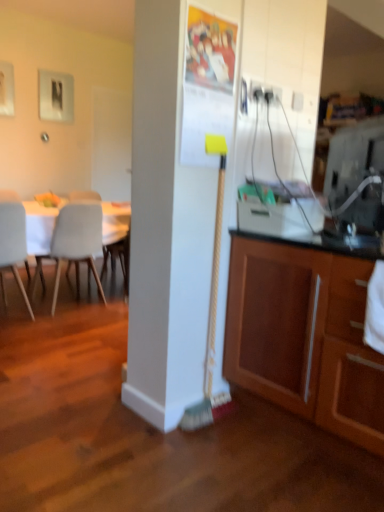
Question: Is white matte chair at left, which is counted as the 2th chair, starting from the right, beside light gray plastic chair at left, acting as the 2th chair starting from the left?

Choices:
 (A) no
 (B) yes

Answer: (A)

Question: Considering the relative sizes of white matte chair at left, which is counted as the 2th chair, starting from the right, and light gray plastic chair at left, acting as the 2th chair starting from the left, in the image provided, is white matte chair at left, which is counted as the 2th chair, starting from the right, taller than light gray plastic chair at left, acting as the 2th chair starting from the left,?

Choices:
 (A) yes
 (B) no

Answer: (A)

Question: From the image's perspective, does white matte chair at left, which is counted as the 2th chair, starting from the right, appear higher than light gray plastic chair at left, the first chair from the right?

Choices:
 (A) yes
 (B) no

Answer: (B)

Question: Is white matte chair at left, which is counted as the first chair, starting from the left, in front of light gray plastic chair at left, acting as the 2th chair starting from the left?

Choices:
 (A) no
 (B) yes

Answer: (B)

Question: Would you say white matte chair at left, which is counted as the first chair, starting from the left, is a long distance from light gray plastic chair at left, acting as the 2th chair starting from the left?

Choices:
 (A) yes
 (B) no

Answer: (B)

Question: Does white matte chair at left, which is counted as the first chair, starting from the left, have a lesser width compared to light gray plastic chair at left, the first chair from the right?

Choices:
 (A) yes
 (B) no

Answer: (B)

Question: Does light gray plastic chair at left, acting as the 2th chair starting from the left, have a lesser width compared to yellow-bristled broom at center?

Choices:
 (A) yes
 (B) no

Answer: (B)

Question: From a real-world perspective, is light gray plastic chair at left, the first chair from the right, physically below yellow-bristled broom at center?

Choices:
 (A) no
 (B) yes

Answer: (B)

Question: Can you confirm if light gray plastic chair at left, the first chair from the right, is shorter than yellow-bristled broom at center?

Choices:
 (A) no
 (B) yes

Answer: (B)

Question: Considering the relative sizes of light gray plastic chair at left, acting as the 2th chair starting from the left, and yellow-bristled broom at center in the image provided, is light gray plastic chair at left, acting as the 2th chair starting from the left, taller than yellow-bristled broom at center?

Choices:
 (A) yes
 (B) no

Answer: (B)

Question: Can you confirm if light gray plastic chair at left, acting as the 2th chair starting from the left, is positioned to the left of yellow-bristled broom at center?

Choices:
 (A) yes
 (B) no

Answer: (A)

Question: From a real-world perspective, is light gray plastic chair at left, acting as the 2th chair starting from the left, on top of yellow-bristled broom at center?

Choices:
 (A) yes
 (B) no

Answer: (B)

Question: From a real-world perspective, does yellow-bristled broom at center stand above wooden cabinet at lower right?

Choices:
 (A) yes
 (B) no

Answer: (A)